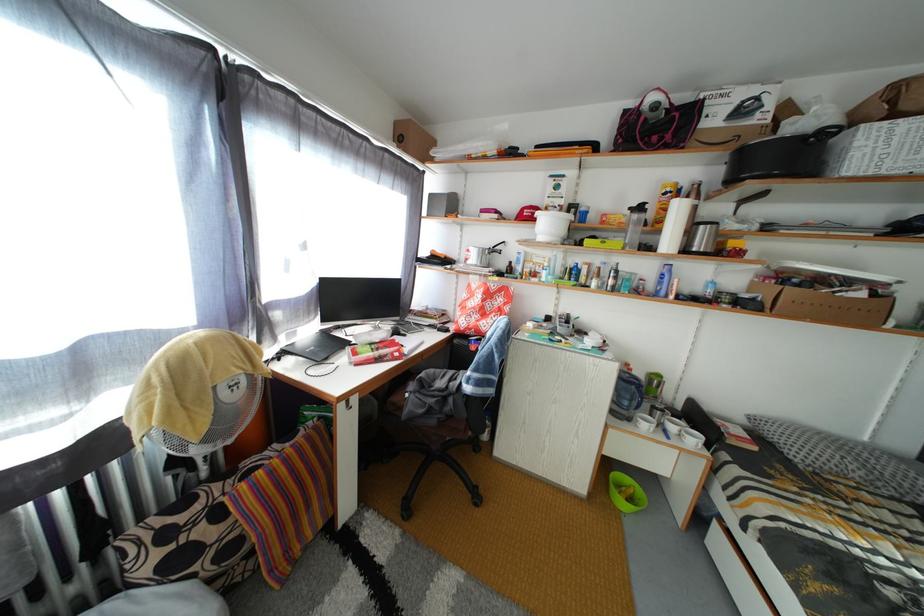
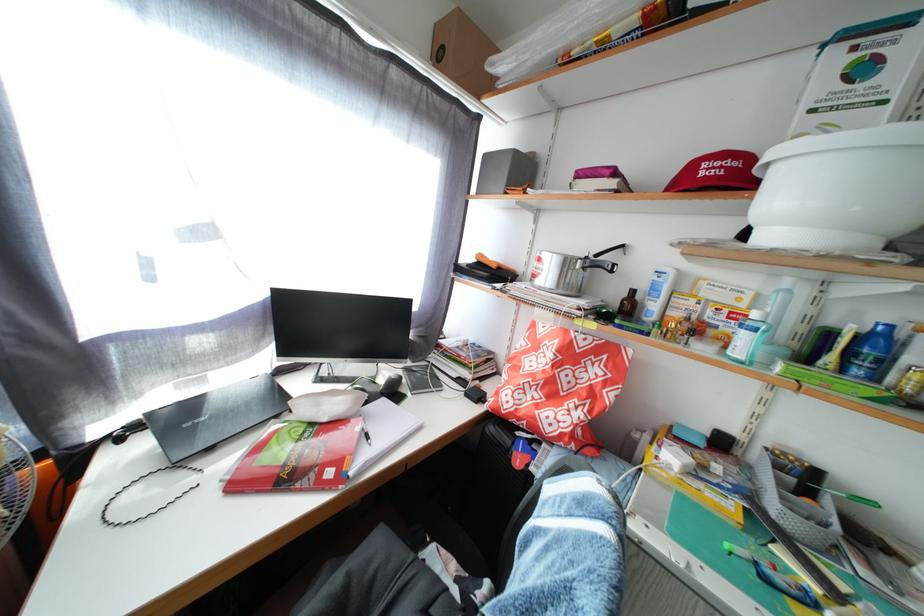
Locate, in the second image, the point that corresponds to point (410, 142) in the first image.

(452, 54)